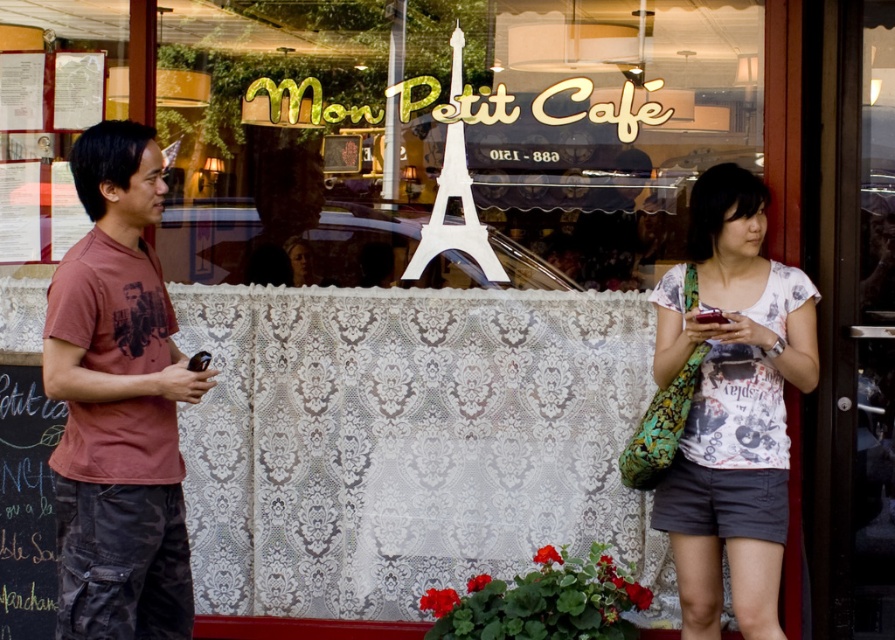
You are a customer entering Mon Petit Cafe and see the white printed shirt at center and the white plastic eiffel tower at center. Which object is closer to the entrance of the cafe?

The white plastic eiffel tower at center is closer to the entrance of the cafe because the white printed shirt at center is positioned on the right side of it, meaning the shirt is further away from the entrance compared to the tower.

You are a customer waiting outside Mon Petit Cafe and want to enter. You see the white printed shirt at center and the white plastic eiffel tower at center. Which object is closer to you as you face the entrance?

The white printed shirt at center is closer to you because it is in front of the white plastic eiffel tower at center.